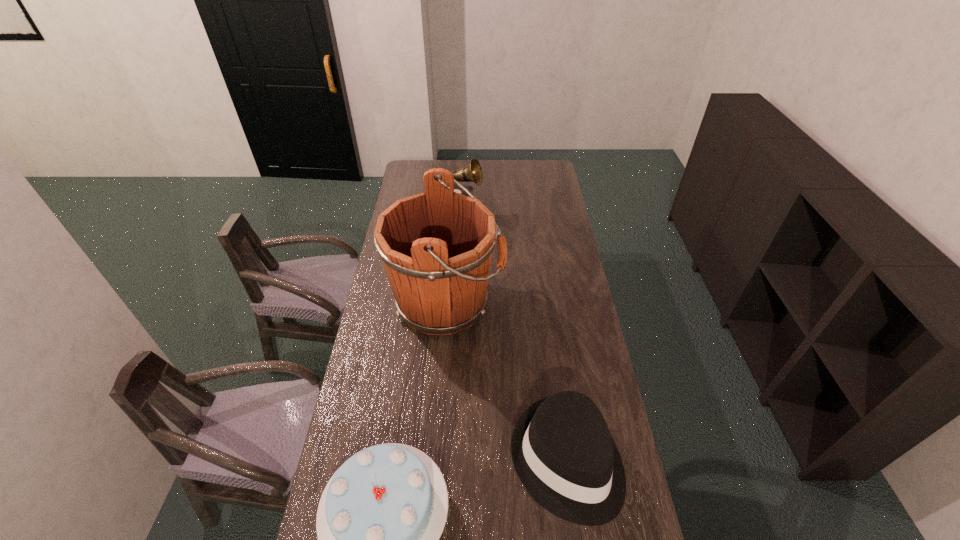
Where is `free space that satisfies the following two spatial constraints: 1. on the horn of the fedora; 2. on the right side of the phonograph record`? free space that satisfies the following two spatial constraints: 1. on the horn of the fedora; 2. on the right side of the phonograph record is located at coordinates (443, 460).

Identify the location of vacant area in the image that satisfies the following two spatial constraints: 1. on the horn of the fedora; 2. on the right side of the farthest object. Image resolution: width=960 pixels, height=540 pixels. (443, 460).

The width and height of the screenshot is (960, 540). I want to click on vacant region that satisfies the following two spatial constraints: 1. on the back side of the fedora; 2. on the horn of the phonograph record, so click(x=531, y=212).